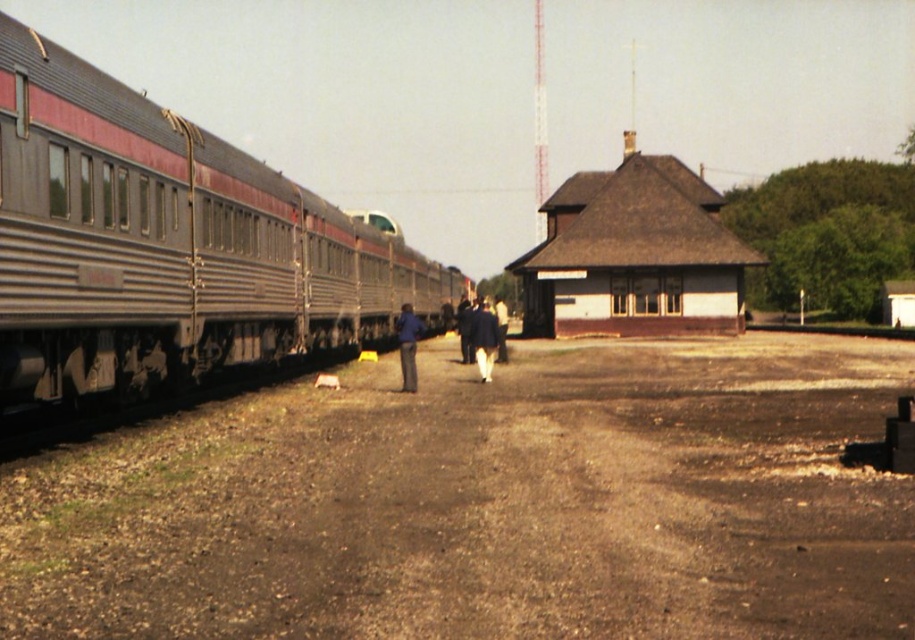
You are standing at the center of the platform in the train station. You want to board the silver metallic train at left. In which direction should you walk to reach it?

You should walk to the left to reach the silver metallic train at left since it is located at the left side of the platform.

You are standing on the platform at the train station and see the brown gravel dirt track at center and the dark blue suit at center. Which object is positioned lower in the scene?

The brown gravel dirt track at center is located below the dark blue suit at center, so it is positioned lower in the scene.

You are a photographer standing on the platform at the train station. You want to take a photo of both the dark blue suit at center and the white fabric pants at center in the same frame. The minimum distance between the subjects for your camera to focus properly is 2 meters. Will you need to adjust your position to include both in focus?

The distance between the dark blue suit at center and white fabric pants at center is 1.88 meters, which is less than the required 2 meters for proper focus. Therefore, you will need to adjust your position to ensure both are in focus.